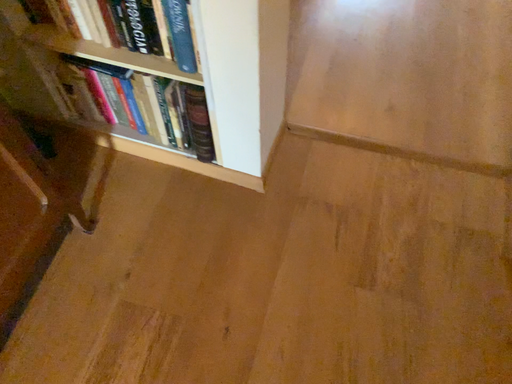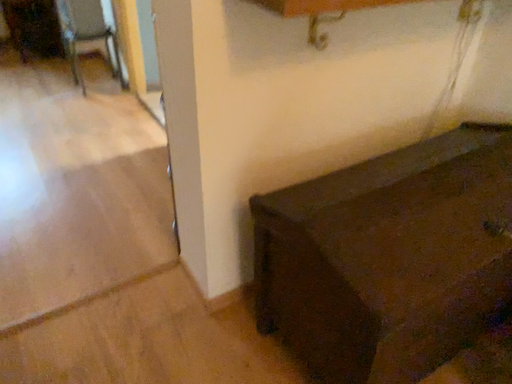
Question: How did the camera likely rotate when shooting the video?

Choices:
 (A) rotated left
 (B) rotated right

Answer: (B)